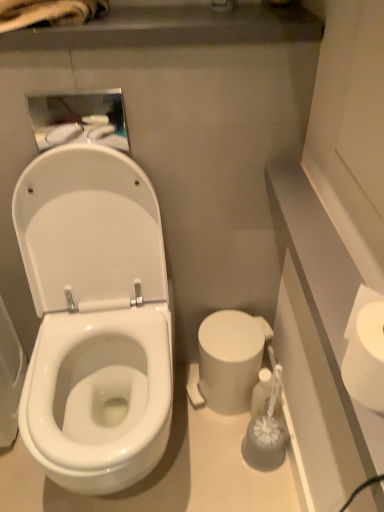
Locate an element on the screen. The width and height of the screenshot is (384, 512). vacant space behind white matte toilet paper at right is located at coordinates (331, 297).